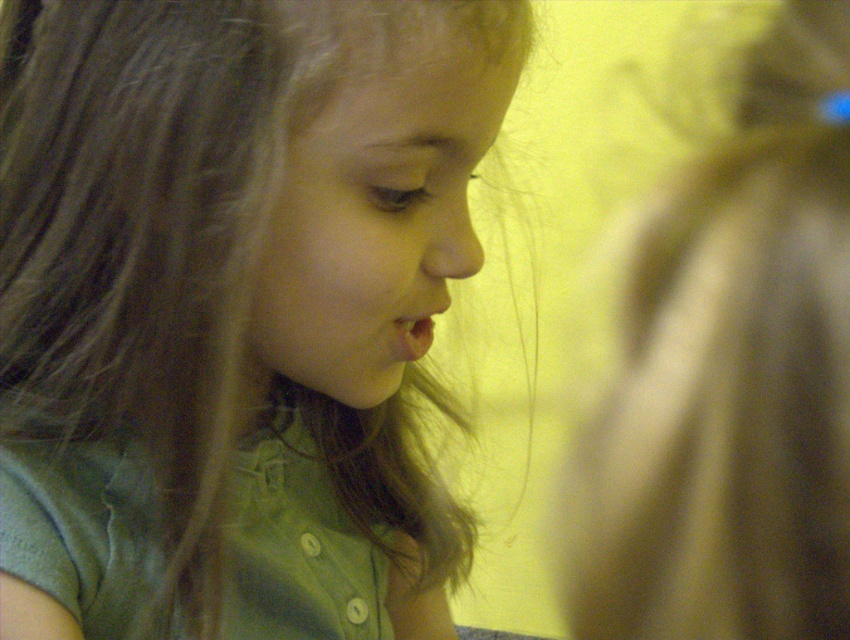
Looking at this image, who is shorter, brown smooth hair at center or brown silky hair at upper right?

Standing shorter between the two is brown silky hair at upper right.

Does brown smooth hair at center have a lesser width compared to brown silky hair at upper right?

No.

Is point (293, 508) positioned after point (721, 456)?

Yes, it is behind point (721, 456).

This screenshot has height=640, width=850. In order to click on brown smooth hair at center in this screenshot , I will do `click(233, 308)`.